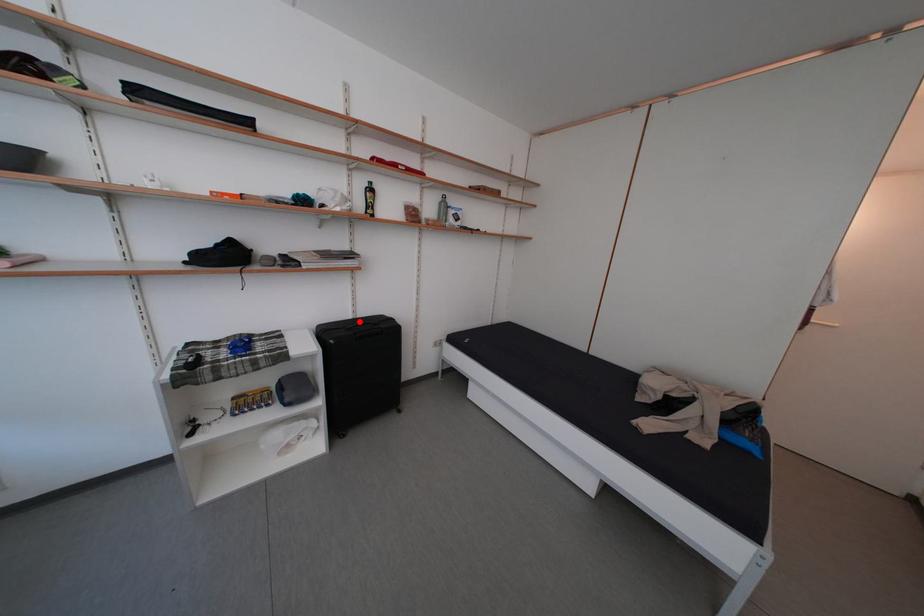
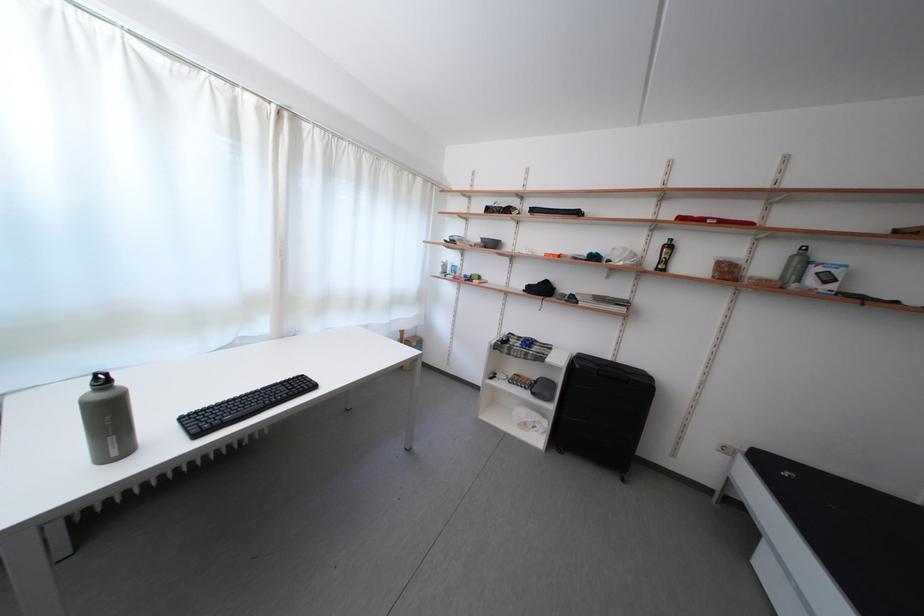
The point at the highlighted location is marked in the first image. Where is the corresponding point in the second image?

(617, 363)